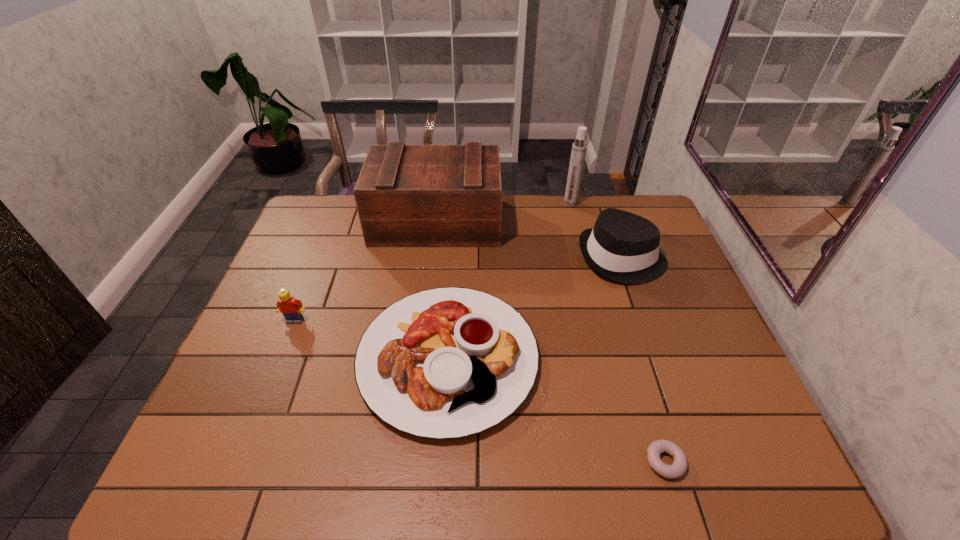
Identify the location of vacant space that is in between the shortest object and the aerosol can. (617, 333).

Identify the location of object that can be found as the fourth closest to the box. Image resolution: width=960 pixels, height=540 pixels. (291, 308).

The width and height of the screenshot is (960, 540). Identify the location of object that is the closest to the leftmost object. (449, 362).

This screenshot has height=540, width=960. I want to click on free spot that satisfies the following two spatial constraints: 1. on the front-facing side of the leftmost object; 2. on the right side of the fifth tallest object, so click(x=280, y=359).

The image size is (960, 540). In order to click on free location that satisfies the following two spatial constraints: 1. on the front side of the shortest object; 2. on the left side of the aerosol can in this screenshot , I will do `click(636, 462)`.

This screenshot has width=960, height=540. What are the coordinates of `vacant position in the image that satisfies the following two spatial constraints: 1. on the front side of the second shortest object; 2. on the right side of the fifth shortest object` in the screenshot? It's located at (420, 359).